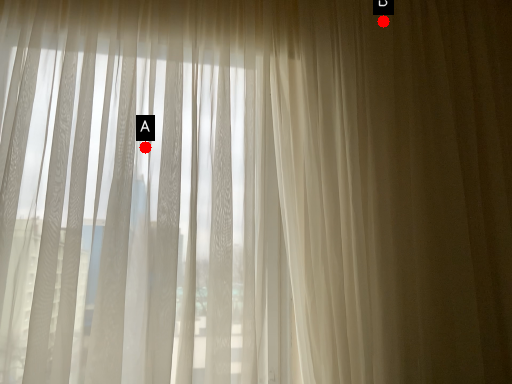
Question: Two points are circled on the image, labeled by A and B beside each circle. Among these points, which one is nearest to the camera?

Choices:
 (A) A is closer
 (B) B is closer

Answer: (A)